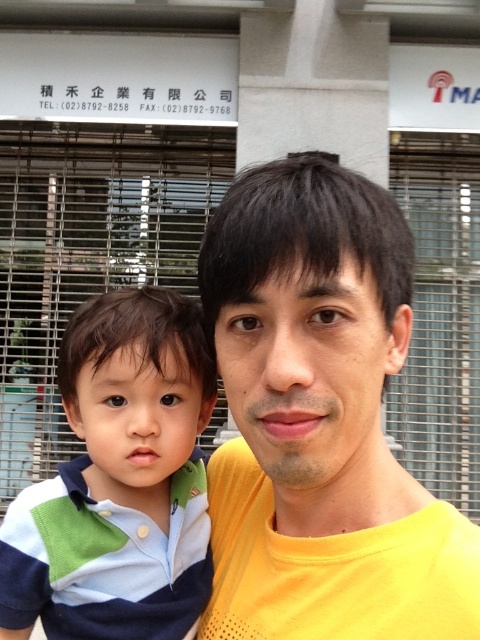
Is yellow matte shirt at center thinner than striped cotton shirt at left?

Indeed, yellow matte shirt at center has a lesser width compared to striped cotton shirt at left.

Can you confirm if yellow matte shirt at center is bigger than striped cotton shirt at left?

Correct, yellow matte shirt at center is larger in size than striped cotton shirt at left.

You are a GUI agent. You are given a task and a screenshot of the screen. Output one action in this format:
    pyautogui.click(x=<x>, y=<y>)
    Task: Click on the yellow matte shirt at center
    The height and width of the screenshot is (640, 480).
    Given the screenshot: What is the action you would take?
    pyautogui.click(x=321, y=420)

Locate an element on the screen. Image resolution: width=480 pixels, height=640 pixels. yellow matte shirt at center is located at coordinates (321, 420).